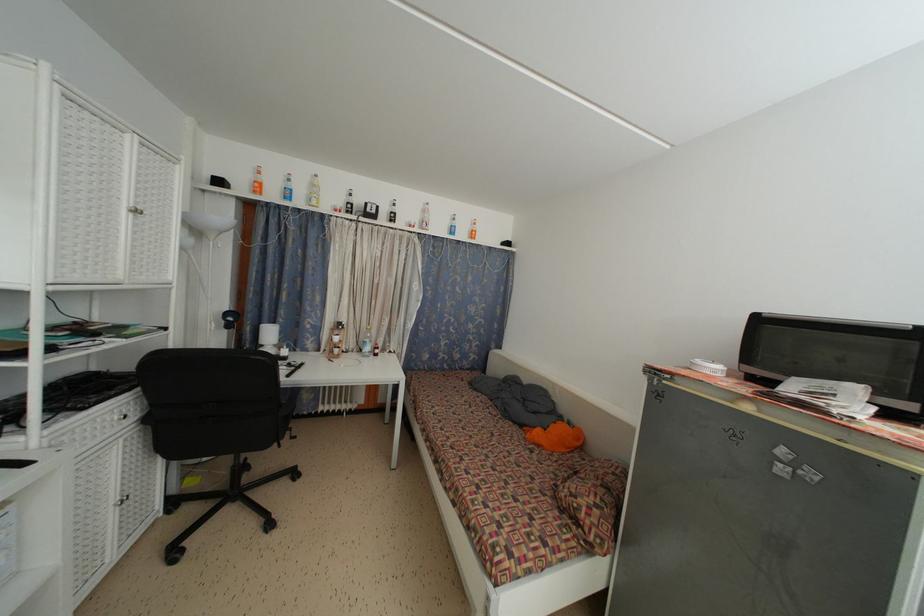
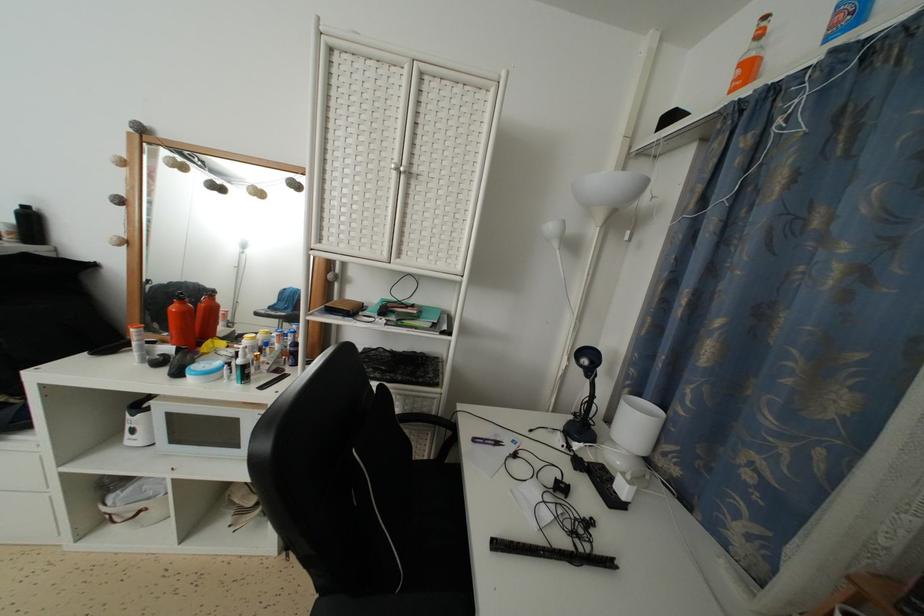
Find the pixel in the second image that matches (x=306, y=370) in the first image.

(614, 569)